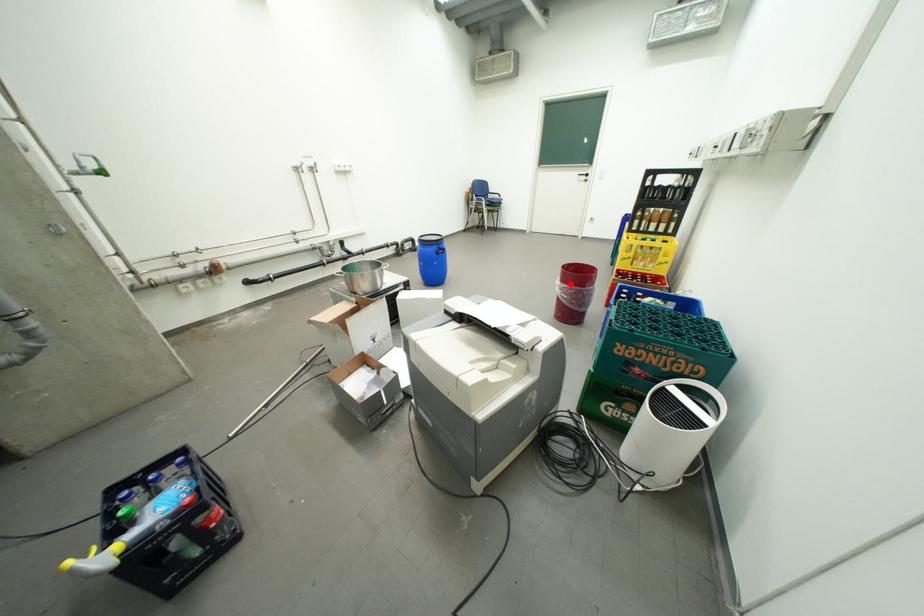
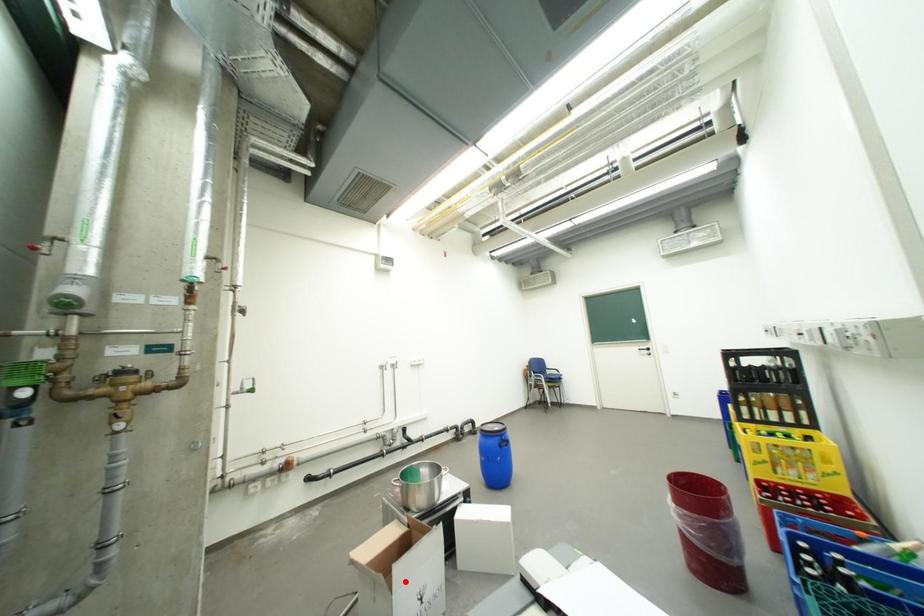
I am providing you with two images of the same scene from different viewpoints. A red point is marked on the first image and another point is marked on the second image. Is the marked point in image1 the same physical position as the marked point in image2?

No